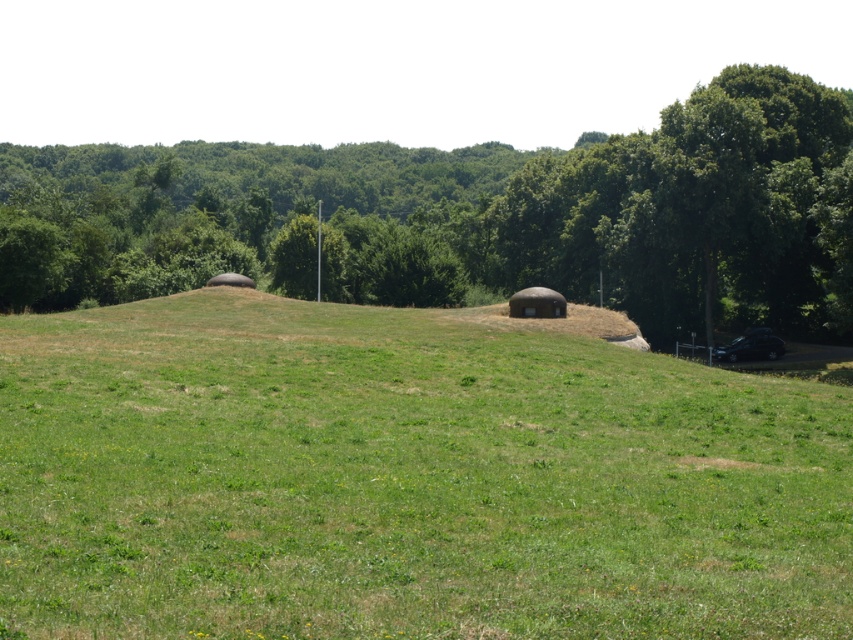
Consider the image. Is green grassy hill at center below green leafy tree at center?

Yes.

Is the position of green grassy hill at center more distant than that of green leafy tree at center?

No.

Is point (202, 564) positioned in front of point (456, 264)?

Yes, it is.

This screenshot has height=640, width=853. I want to click on green grassy hill at center, so click(404, 481).